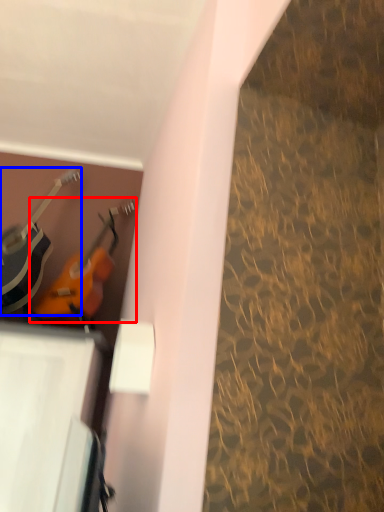
Question: Which object is further to the camera taking this photo, guitar (highlighted by a red box) or guitar (highlighted by a blue box)?

Choices:
 (A) guitar
 (B) guitar

Answer: (A)